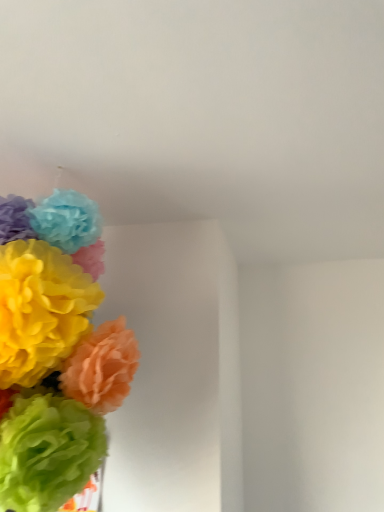
Measure the distance between point (39, 256) and camera.

Point (39, 256) and camera are 34.37 inches apart.

Describe the element at coordinates (55, 351) in the screenshot. I see `matte paper flower at left` at that location.

In order to click on matte paper flower at left in this screenshot , I will do `click(55, 351)`.

You are a GUI agent. You are given a task and a screenshot of the screen. Output one action in this format:
    pyautogui.click(x=<x>, y=<y>)
    Task: Click on the matte paper flower at left
    Image resolution: width=384 pixels, height=512 pixels.
    Given the screenshot: What is the action you would take?
    pyautogui.click(x=55, y=351)